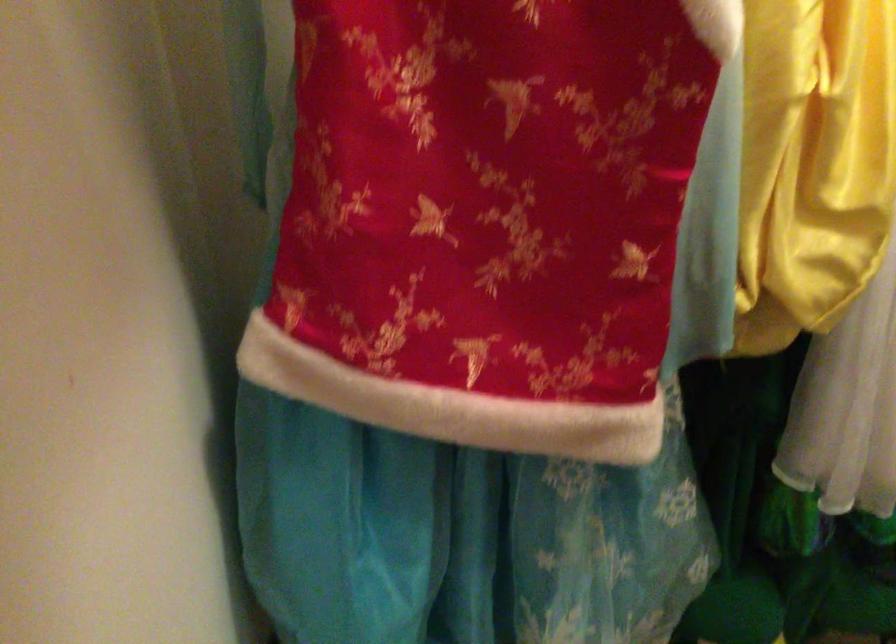
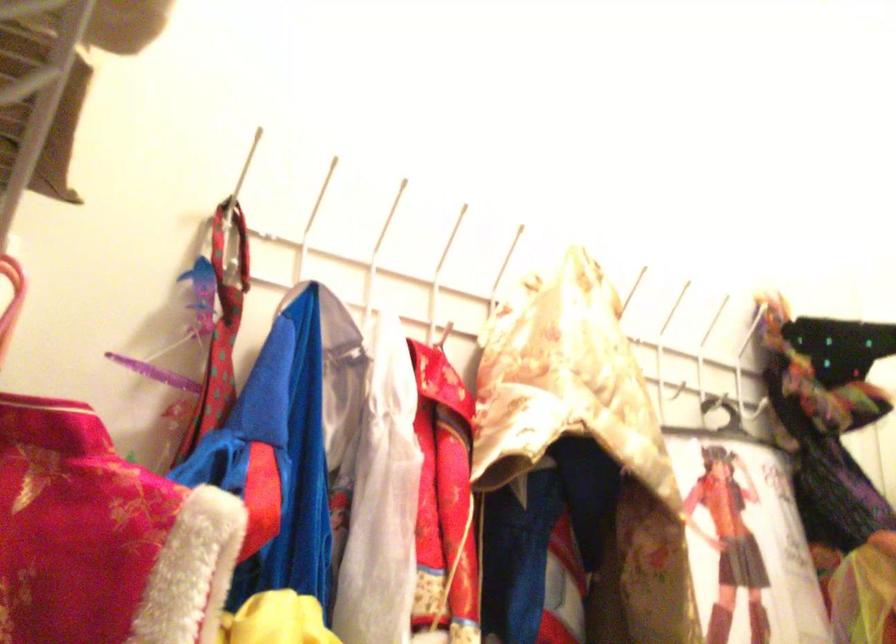
The first image is from the beginning of the video and the second image is from the end. How did the camera likely rotate when shooting the video?

The camera's rotation is toward right-up.